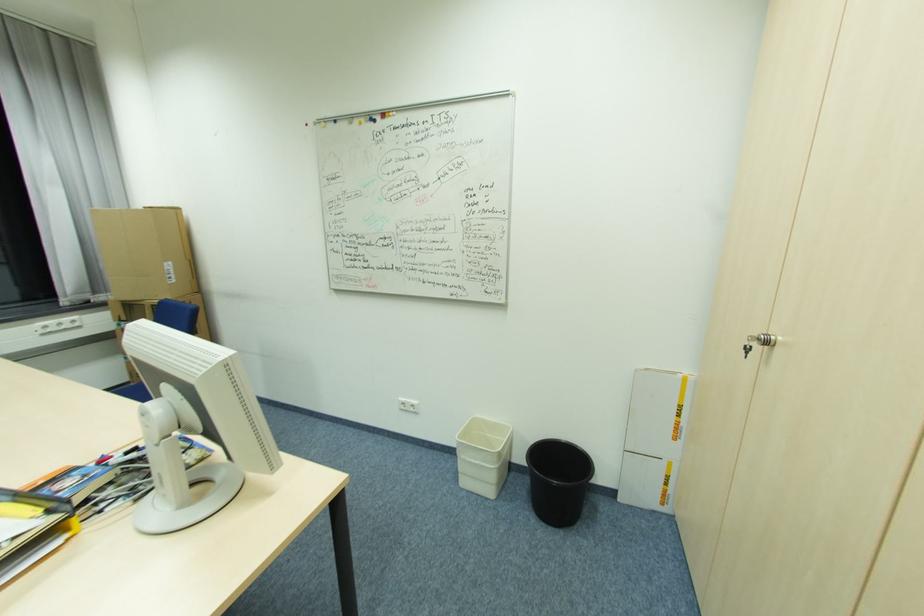
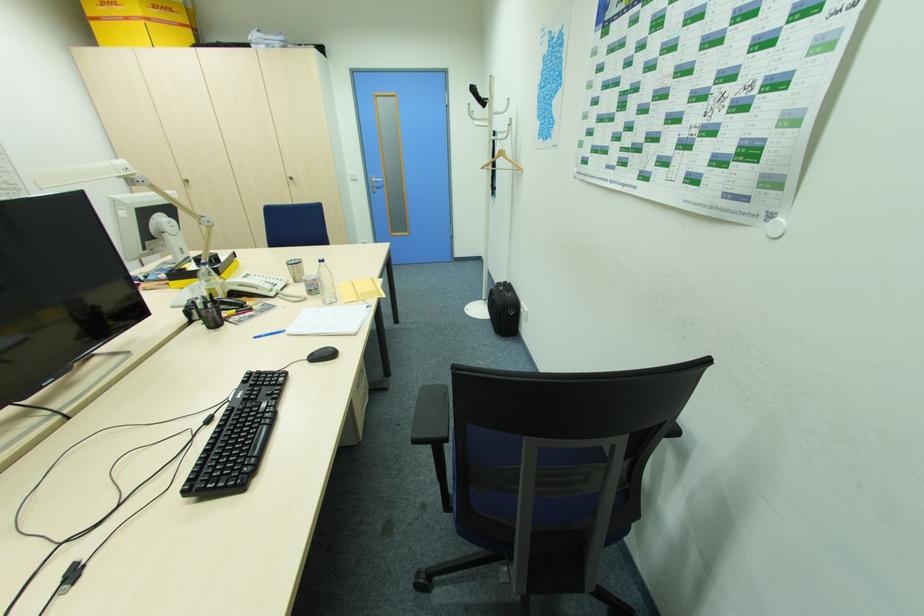
Find the pixel in the second image that matches point 752,351 in the first image.

(188, 185)